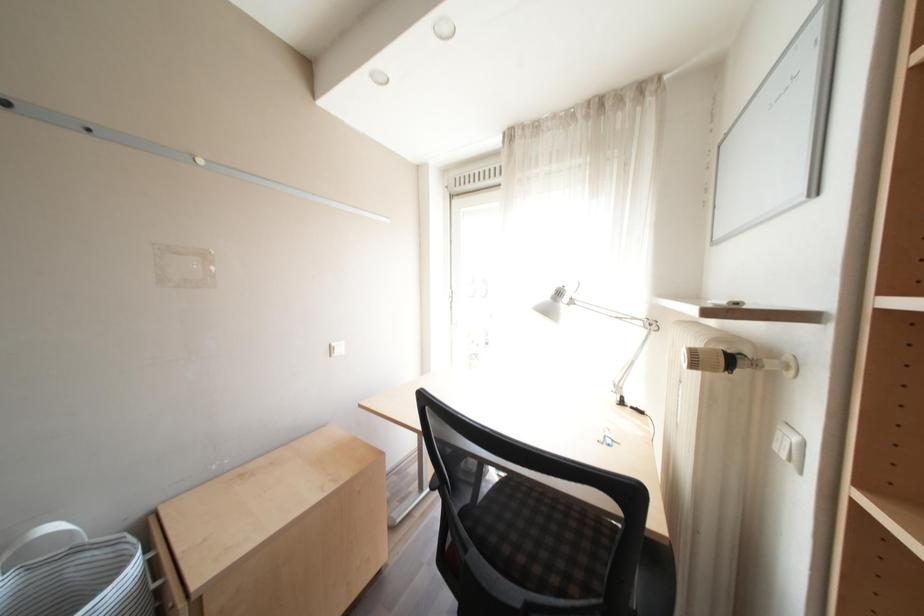
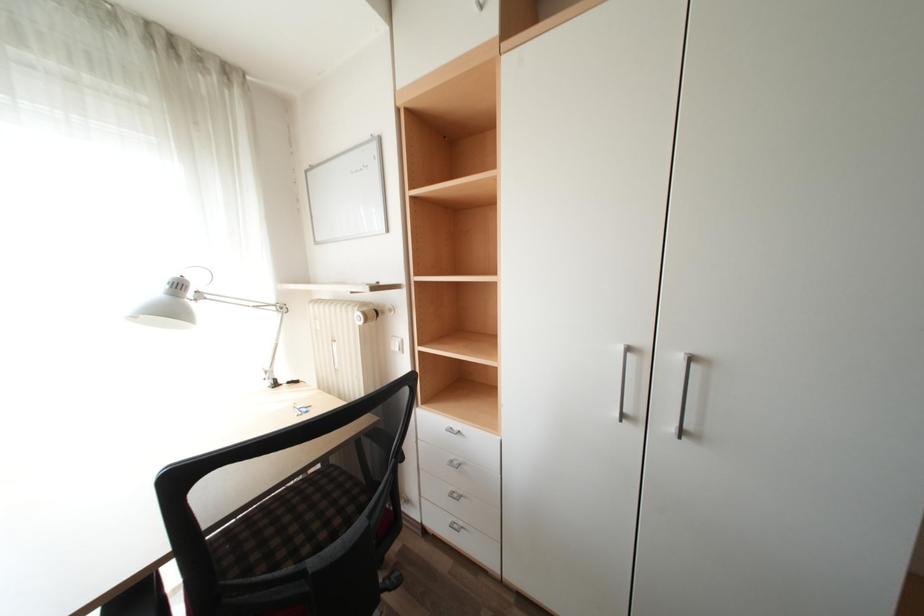
Question: The images are taken continuously from a first-person perspective. In which direction is your viewpoint rotating?

Choices:
 (A) Left
 (B) Right
 (C) Up
 (D) Down

Answer: (B)